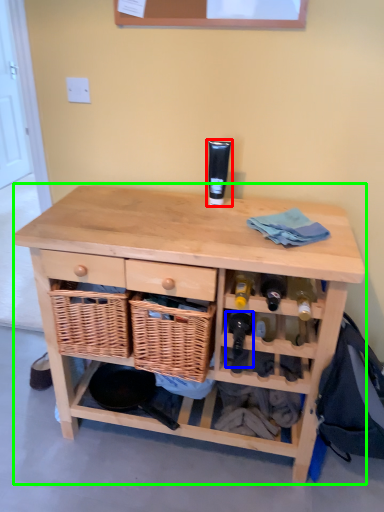
Question: Which is nearer to the toiletry (highlighted by a red box)? wine bottle (highlighted by a blue box) or table (highlighted by a green box).

Choices:
 (A) wine bottle
 (B) table

Answer: (B)